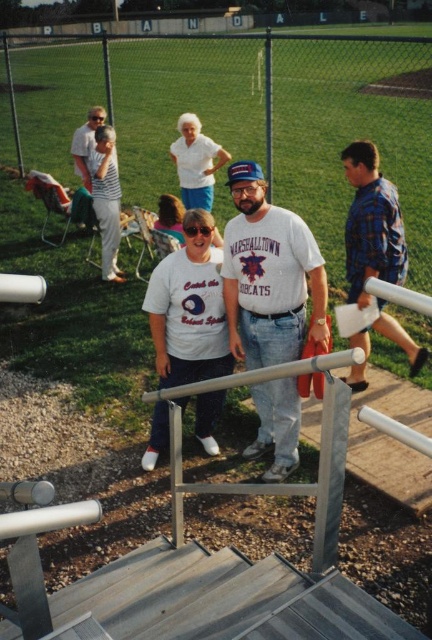
Question: Can you confirm if white cotton t-shirt at center is positioned to the right of blue plaid shirt at right?

Choices:
 (A) no
 (B) yes

Answer: (A)

Question: Which point appears closest to the camera in this image?

Choices:
 (A) (384, 273)
 (B) (299, 308)

Answer: (B)

Question: Which object appears farthest from the camera in this image?

Choices:
 (A) blue plaid shirt at right
 (B) white cotton t-shirt at center

Answer: (A)

Question: Considering the relative positions of white cotton t-shirt at center and blue plaid shirt at right in the image provided, where is white cotton t-shirt at center located with respect to blue plaid shirt at right?

Choices:
 (A) left
 (B) right

Answer: (A)

Question: Is white cotton t-shirt at center positioned at the back of blue plaid shirt at right?

Choices:
 (A) no
 (B) yes

Answer: (A)